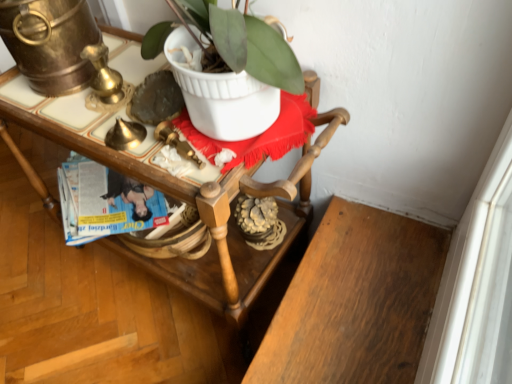
In order to click on vacant space to the left of wooden desk at center in this screenshot , I will do `click(58, 296)`.